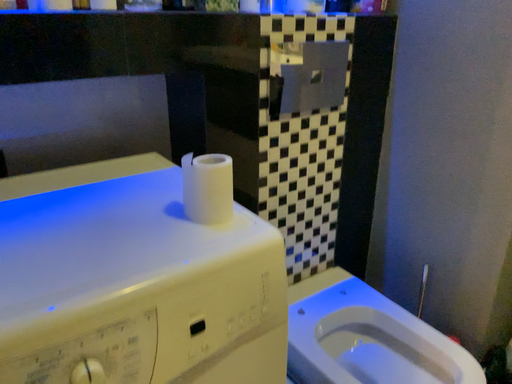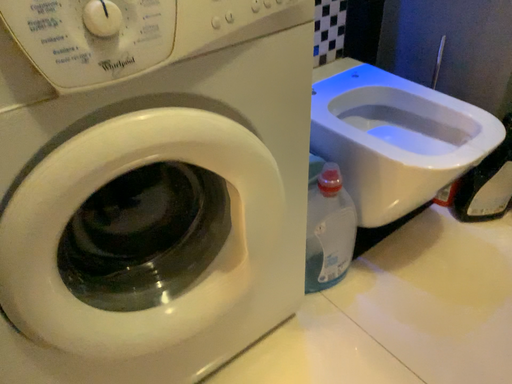
Question: Which way did the camera rotate in the video?

Choices:
 (A) rotated upward
 (B) rotated downward

Answer: (B)